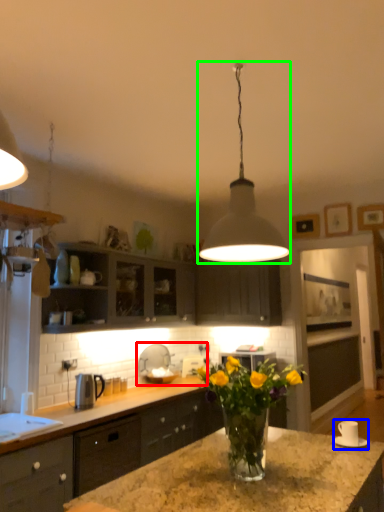
Question: Considering the real-world distances, which object is farthest from sink (highlighted by a red box)? appliance (highlighted by a blue box) or lamp (highlighted by a green box)?

Choices:
 (A) appliance
 (B) lamp

Answer: (B)